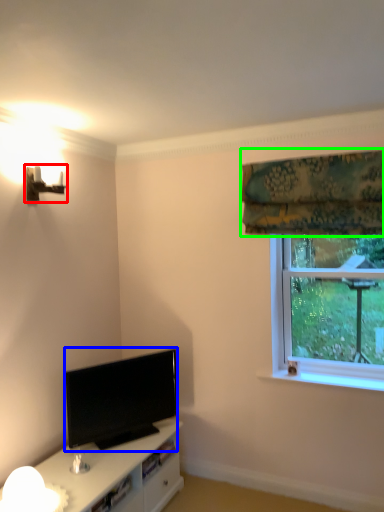
Question: Based on their relative distances, which object is farther from table lamp (highlighted by a red box)? Choose from television (highlighted by a blue box) and curtain (highlighted by a green box).

Choices:
 (A) television
 (B) curtain

Answer: (B)